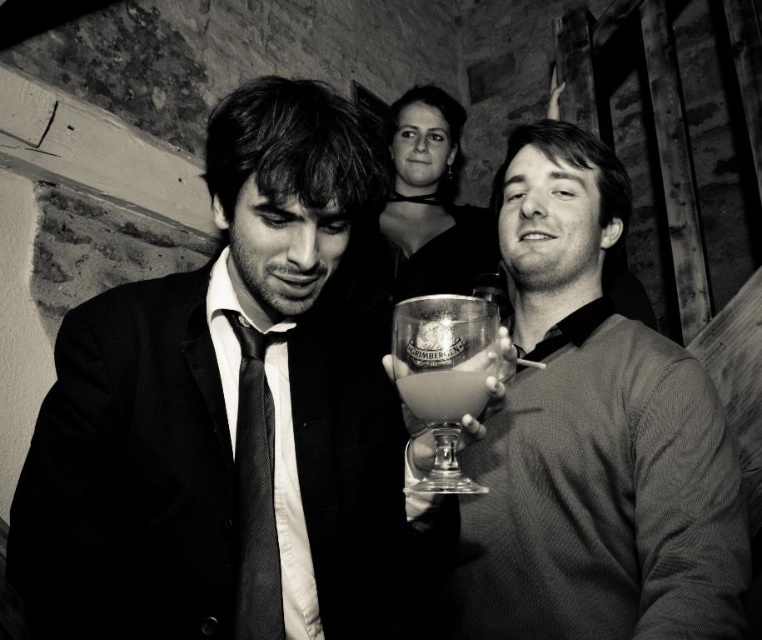
You are a photographer adjusting your camera focus. You have two points in your viewfinder labeled as point (412,330) and point (253,355). Which point should you focus on if you want to ensure the foreground subject is sharp?

You should focus on point (412,330) because it is closer to the camera than point (253,355), ensuring the foreground subject is in sharp focus.

What is located at the coordinates point (255, 493)?

The black textured tie at center is located at point (255, 493).

You are a photographer adjusting your camera settings to focus on the matte black suit at center and the smooth glass goblet at center. Which object should you focus on first to ensure both are in sharp focus?

The matte black suit at center is in front of the smooth glass goblet at center, so you should focus on the matte black suit at center first to ensure both are in sharp focus.